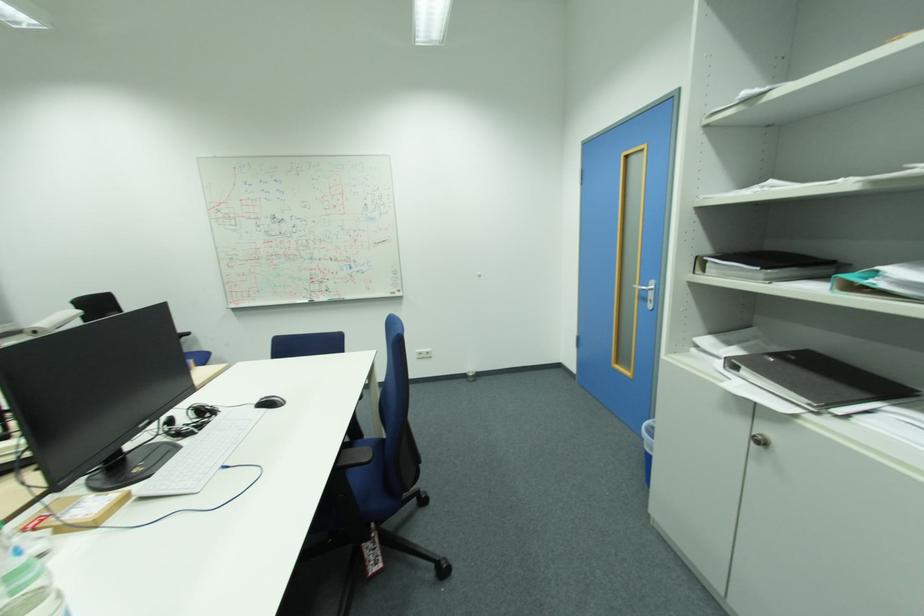
Describe the element at coordinates (760, 440) in the screenshot. The width and height of the screenshot is (924, 616). I see `a silver cabinet lock` at that location.